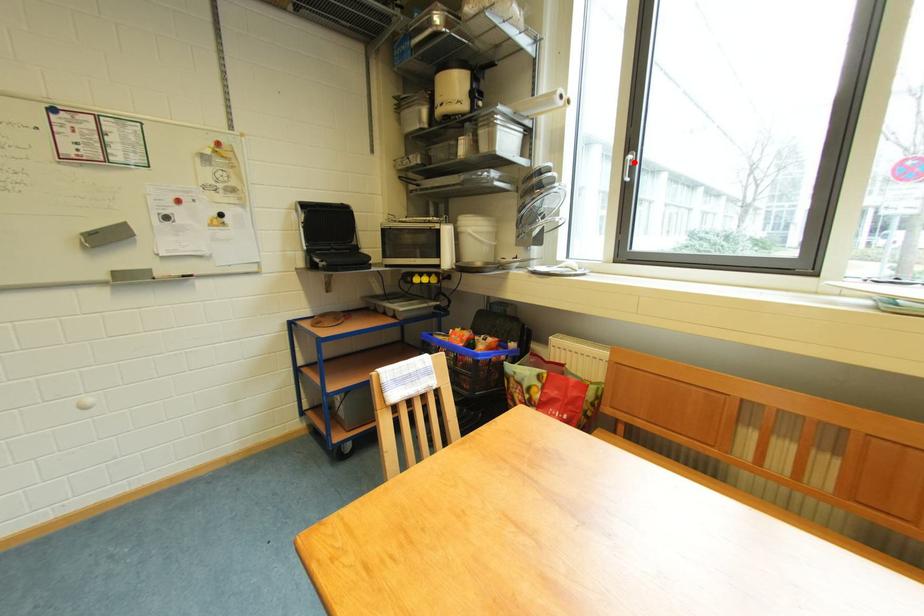
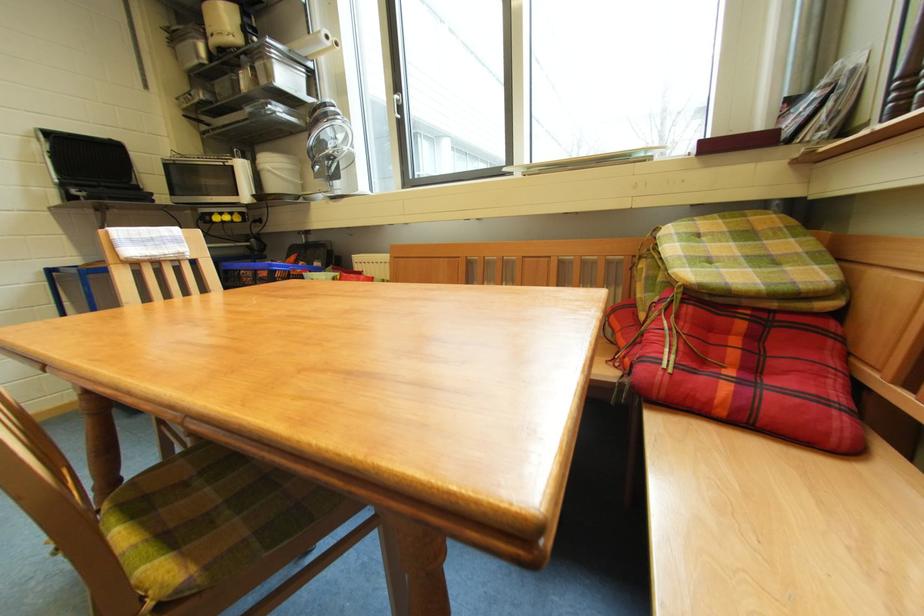
Find the pixel in the second image that matches the highlighted location in the first image.

(402, 102)